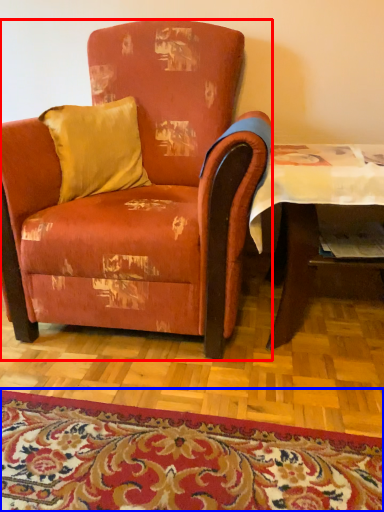
Question: Which object appears closest to the camera in this image, chair (highlighted by a red box) or mat (highlighted by a blue box)?

Choices:
 (A) chair
 (B) mat

Answer: (B)